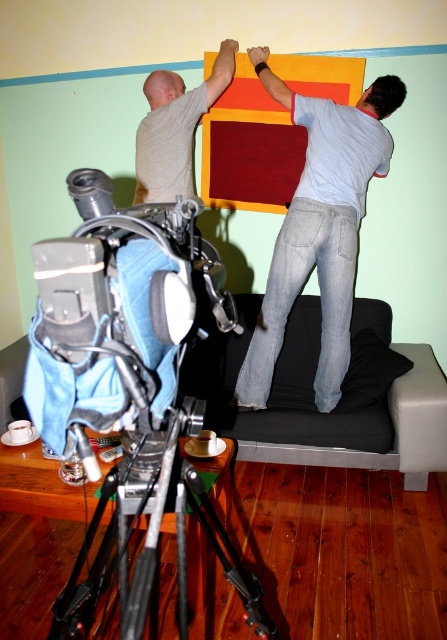
Is black fabric couch at lower right to the right of black metal tripod at lower left from the viewer's perspective?

Correct, you'll find black fabric couch at lower right to the right of black metal tripod at lower left.

Who is positioned more to the right, black fabric couch at lower right or black metal tripod at lower left?

black fabric couch at lower right

The image size is (447, 640). Find the location of `black fabric couch at lower right`. black fabric couch at lower right is located at coordinates (315, 406).

Locate an element on the screen. The height and width of the screenshot is (640, 447). black fabric couch at lower right is located at coordinates (315, 406).

Who is more forward, (283, 92) or (177, 163)?

Positioned in front is point (283, 92).

Can you confirm if light blue denim jeans at upper right is bigger than matte gray shirt at upper center?

Indeed, light blue denim jeans at upper right has a larger size compared to matte gray shirt at upper center.

In order to click on light blue denim jeans at upper right in this screenshot , I will do `click(320, 227)`.

Can you confirm if black fabric couch at lower right is smaller than matte gray shirt at upper center?

No.

Is the position of black fabric couch at lower right less distant than that of matte gray shirt at upper center?

Yes, black fabric couch at lower right is in front of matte gray shirt at upper center.

Who is more forward, (x=316, y=342) or (x=219, y=68)?

Point (x=219, y=68) is more forward.

At what (x,y) coordinates should I click in order to perform the action: click on black fabric couch at lower right. Please return your answer as a coordinate pair (x, y). Looking at the image, I should click on (315, 406).